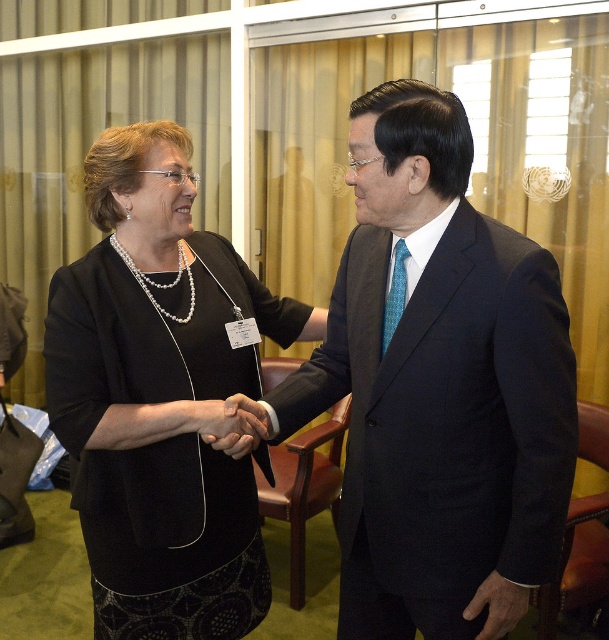
Question: From the image, what is the correct spatial relationship of smooth skin handshake at center in relation to pearl necklace at center?

Choices:
 (A) below
 (B) above

Answer: (A)

Question: Which object appears farthest from the camera in this image?

Choices:
 (A) matte black suit at center
 (B) smooth skin handshake at center

Answer: (B)

Question: Which object is positioned farthest from the pearl necklace at center?

Choices:
 (A) smooth skin handshake at center
 (B) black matte dress at center

Answer: (A)

Question: Does black matte dress at center appear under pearl necklace at center?

Choices:
 (A) no
 (B) yes

Answer: (B)

Question: Can you confirm if black matte dress at center is thinner than pearl necklace at center?

Choices:
 (A) yes
 (B) no

Answer: (B)

Question: Which point appears farthest from the camera in this image?

Choices:
 (A) (116, 246)
 (B) (224, 420)

Answer: (A)